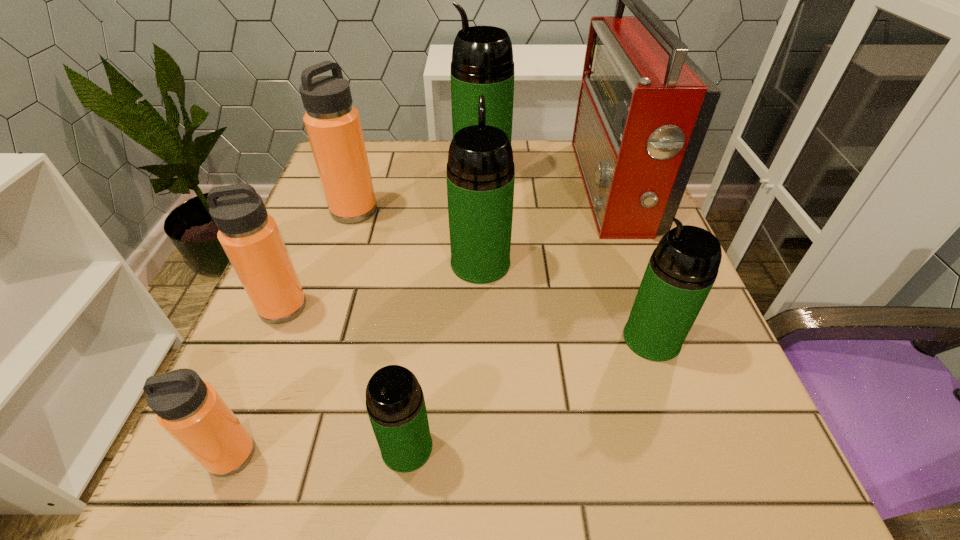
The width and height of the screenshot is (960, 540). I want to click on thermos bottle positioned at the right edge, so click(x=682, y=269).

You are a GUI agent. You are given a task and a screenshot of the screen. Output one action in this format:
    pyautogui.click(x=<x>, y=<y>)
    Task: Click on the object that is at the near left corner
    
    Given the screenshot: What is the action you would take?
    pyautogui.click(x=190, y=410)

Where is `object that is at the far right corner`? object that is at the far right corner is located at coordinates (644, 108).

You are a GUI agent. You are given a task and a screenshot of the screen. Output one action in this format:
    pyautogui.click(x=<x>, y=<y>)
    Task: Click on the free space at the near edge
    Image resolution: width=960 pixels, height=540 pixels.
    Given the screenshot: What is the action you would take?
    pyautogui.click(x=320, y=454)

Find the location of a particular element. Image resolution: width=960 pixels, height=540 pixels. free point at the left edge is located at coordinates (323, 354).

Locate an element on the screen. vacant space at the right edge of the desktop is located at coordinates (631, 280).

You are a GUI agent. You are given a task and a screenshot of the screen. Output one action in this format:
    pyautogui.click(x=<x>, y=<y>)
    Task: Click on the vacant region at the far left corner of the desktop
    Image resolution: width=960 pixels, height=540 pixels.
    Given the screenshot: What is the action you would take?
    pyautogui.click(x=391, y=163)

Where is `free location at the near left corner of the desktop`? This screenshot has width=960, height=540. free location at the near left corner of the desktop is located at coordinates pos(215,476).

What are the coordinates of `free space at the near right corner` in the screenshot? It's located at (769, 472).

The height and width of the screenshot is (540, 960). What are the coordinates of `free space between the farthest orange thermos bottle and the second farthest orange thermos bottle` in the screenshot? It's located at (319, 259).